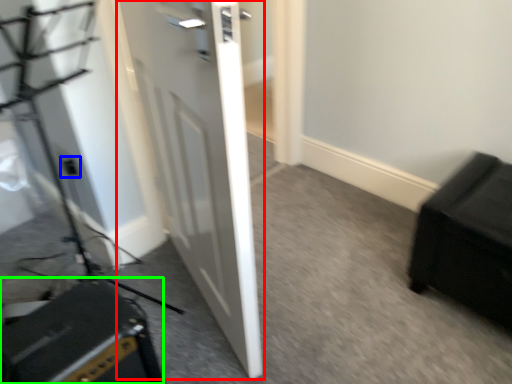
Question: Considering the real-world distances, which object is closest to door (highlighted by a red box)? electric outlet (highlighted by a blue box) or speaker (highlighted by a green box).

Choices:
 (A) electric outlet
 (B) speaker

Answer: (B)